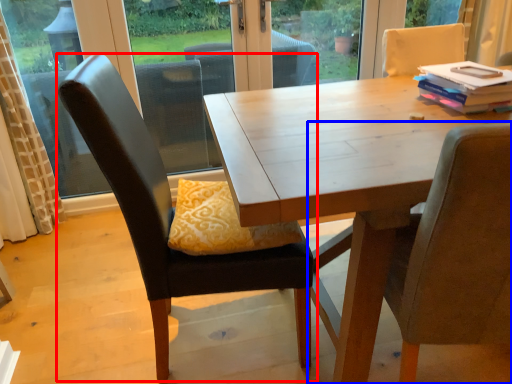
Question: Which object appears closest to the camera in this image, chair (highlighted by a red box) or chair (highlighted by a blue box)?

Choices:
 (A) chair
 (B) chair

Answer: (B)